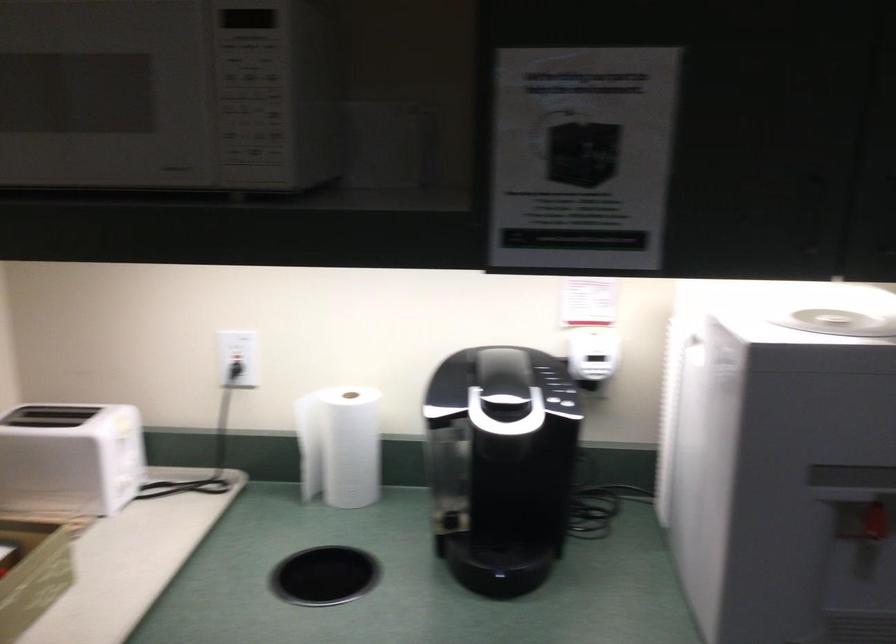
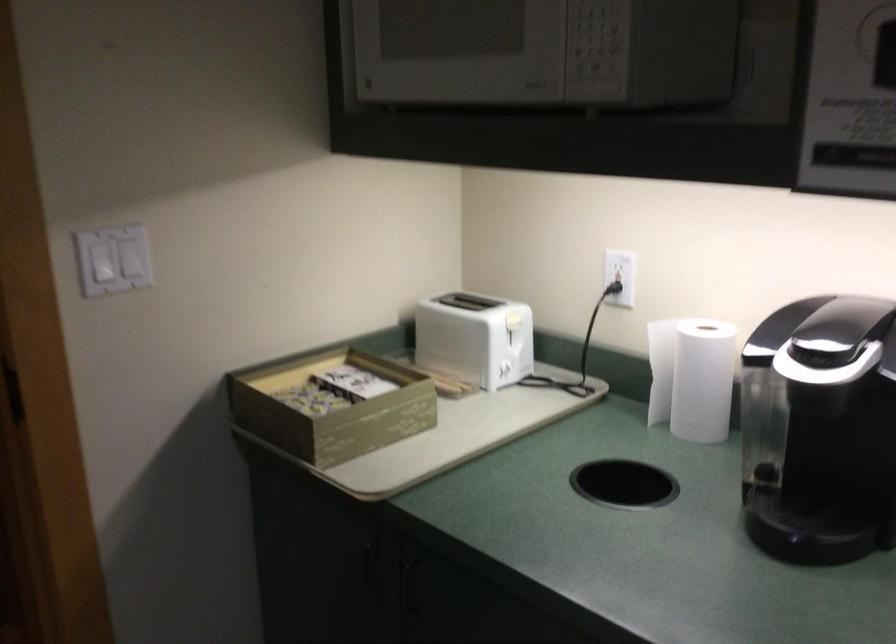
In the second image, find the point that corresponds to pixel 236 371 in the first image.

(613, 288)